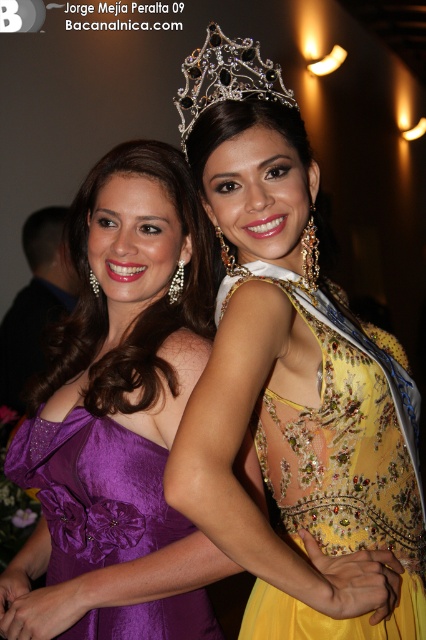
You are at a formal event and want to take a photo of both women. You notice two points in the image labeled as point (250, 64) and point (146, 480). Which point is nearer to you?

A: Point (250, 64) is closer to the viewer than point (146, 480).

You are a photographer at a formal event. You need to position the yellow beaded dress at center and the purple satin dress at left in a way that accommodates their body types. Which dress should be placed closer to the camera to avoid looking too slim compared to the other?

The yellow beaded dress at center is thinner than the purple satin dress at left, so placing the yellow beaded dress at center closer to the camera will help balance their visual proportions.